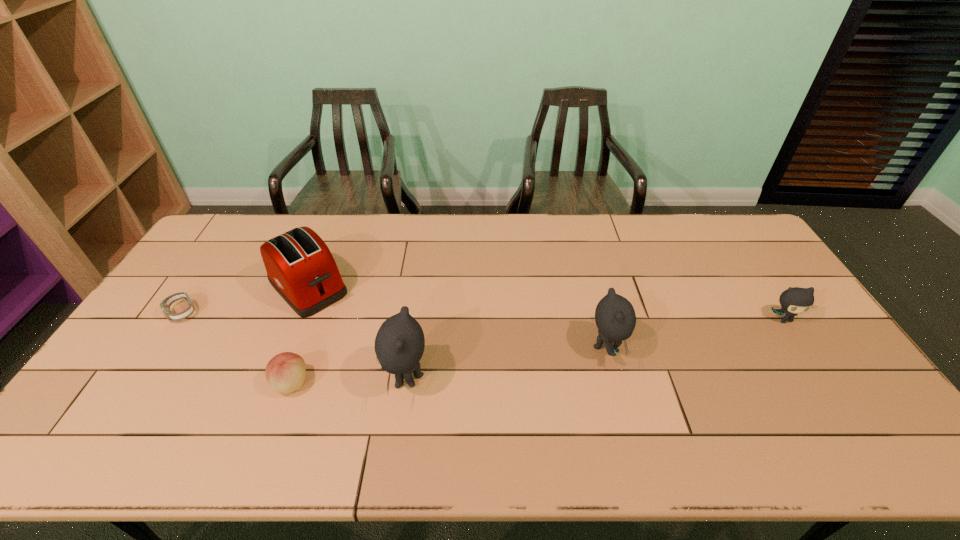
All kittens are currently evenly spaced. To continue this pattern, where would you add another kitten on the left? Please point out a vacant spot. Please provide its 2D coordinates. Your answer should be formatted as a tuple, i.e. [(x, y)], where the tuple contains the x and y coordinates of a point satisfying the conditions above.

[(178, 414)]